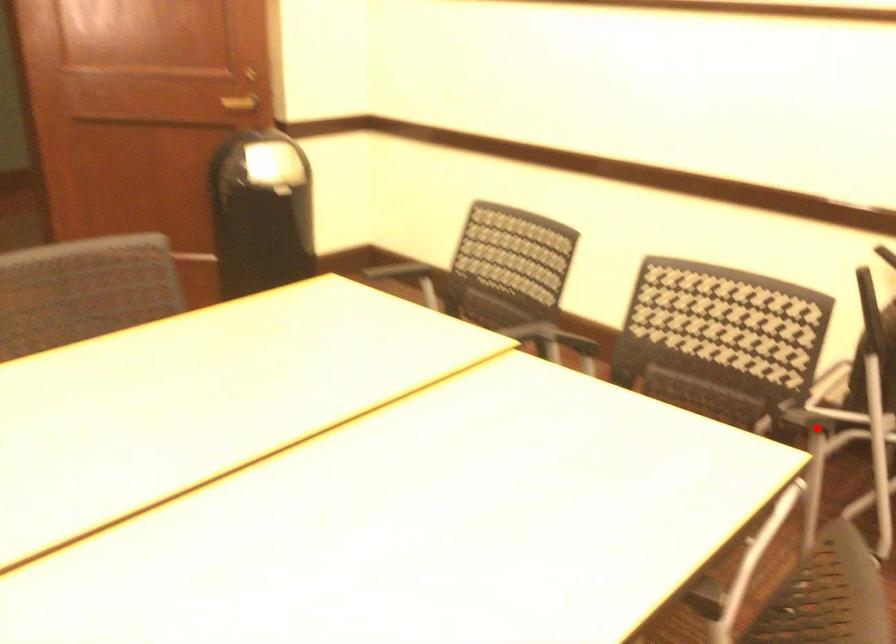
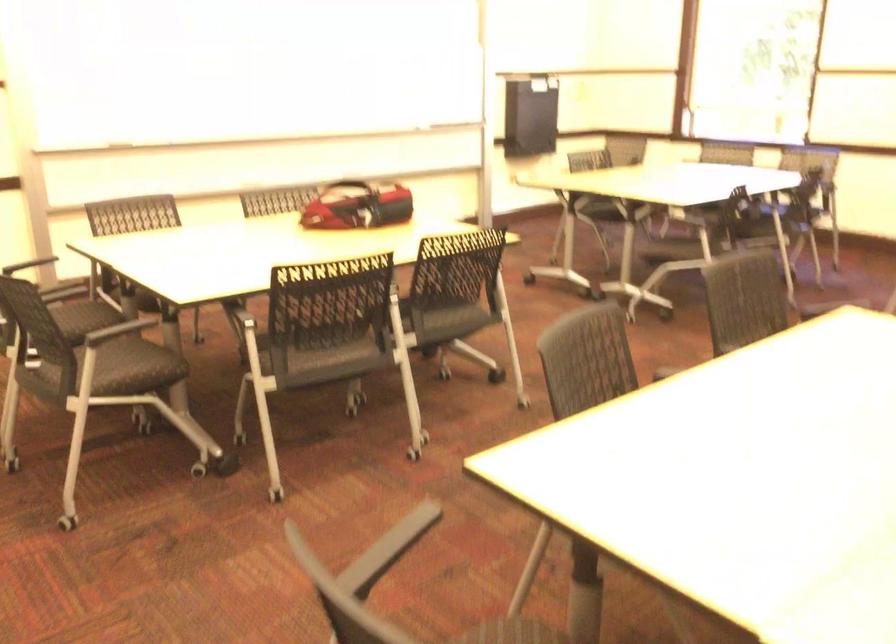
Question: I am providing you with two images of the same scene from different viewpoints. Image1 has a red point marked. In image2, the corresponding 3D location appears at what relative position? Reply with the corresponding letter.

Choices:
 (A) Closer
 (B) Farther

Answer: (A)